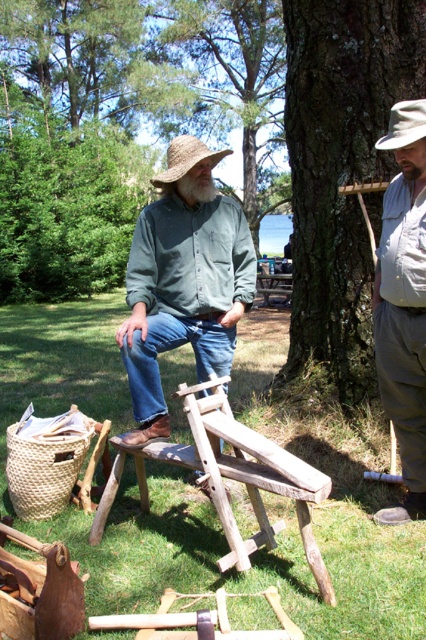
Question: Does wooden plank chair at center come in front of straw hat at upper center?

Choices:
 (A) yes
 (B) no

Answer: (A)

Question: Can you confirm if green matte shirt at center is thinner than straw hat at upper center?

Choices:
 (A) no
 (B) yes

Answer: (A)

Question: Is green matte shirt at center positioned before gray cotton shirt at upper right?

Choices:
 (A) no
 (B) yes

Answer: (A)

Question: Estimate the real-world distances between objects in this image. Which object is farther from the white soft beard at center?

Choices:
 (A) green matte shirt at center
 (B) green bark tree at upper center

Answer: (B)

Question: Based on their relative distances, which object is farther from the straw hat at upper center?

Choices:
 (A) brown rough bark at center
 (B) green matte shirt at center
 (C) brown straw hat at center
 (D) gray cotton shirt at upper right

Answer: (A)

Question: Based on their relative distances, which object is nearer to the brown rough bark at center?

Choices:
 (A) straw hat at upper center
 (B) green matte shirt at center
 (C) brown straw hat at center
 (D) gray cotton shirt at upper right

Answer: (D)